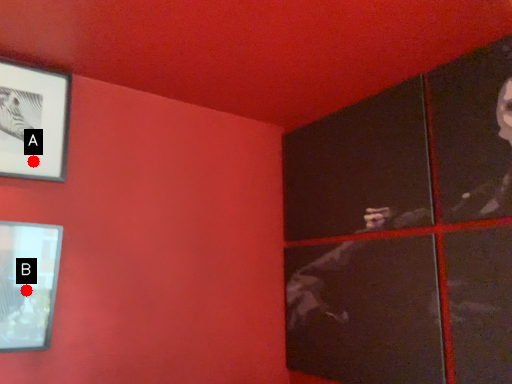
Question: Two points are circled on the image, labeled by A and B beside each circle. Which point appears farthest from the camera in this image?

Choices:
 (A) A is further
 (B) B is further

Answer: (A)